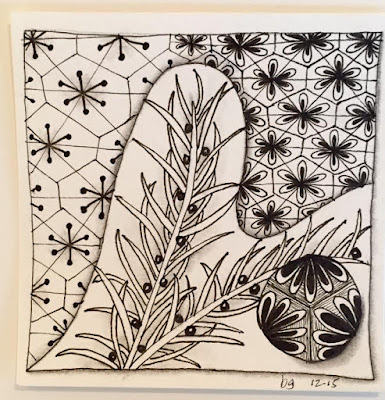
The height and width of the screenshot is (400, 385). I want to click on zoom in of floral pattern, so click(x=302, y=306).